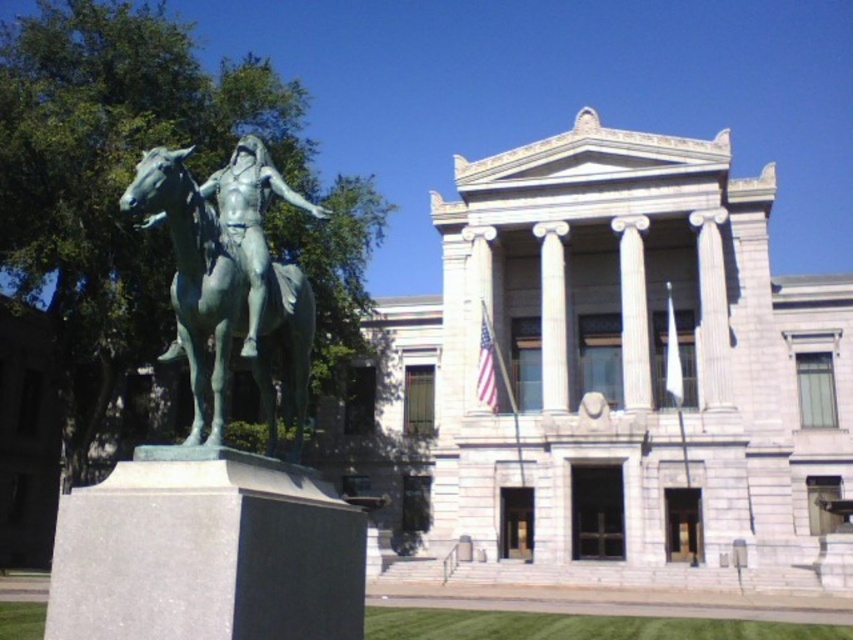
Based on the photo, you are standing in front of the statue and want to place a small flower on the green grass at lower center. To do this, should you walk towards the white marble column at center or away from it?

The green grass at lower center is located below the white marble column at center, so you should walk towards the white marble column at center to reach the green grass at lower center.

You are standing in front of the statue of the Native American rider. There are two points marked in the image, one at coordinates point (286, 280) and another at point (796, 632). Which point is closer to you?

Point (286, 280) is in front of point (796, 632), so it is closer to you.